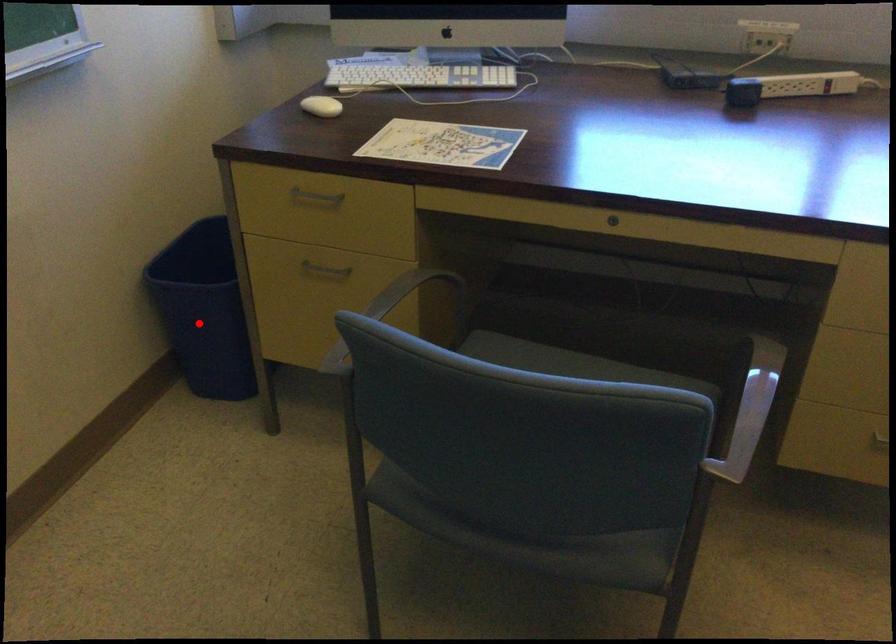
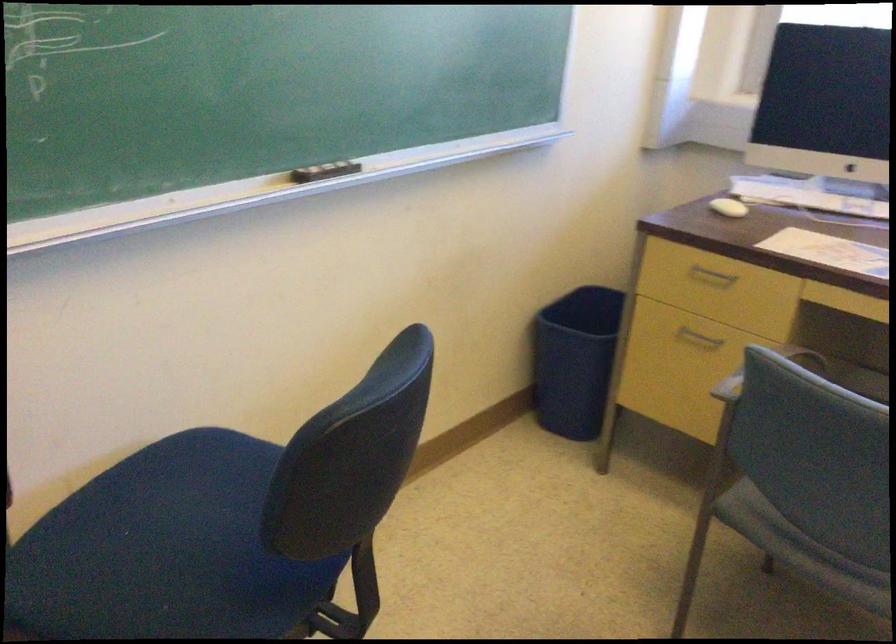
In the second image, find the point that corresponds to the highlighted location in the first image.

(574, 360)